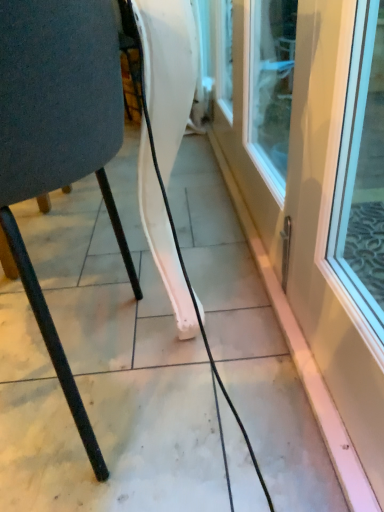
Question: Considering the positions of white glossy door at right and matte black chair at left in the image, is white glossy door at right bigger or smaller than matte black chair at left?

Choices:
 (A) small
 (B) big

Answer: (A)

Question: Considering the positions of white glossy door at right and matte black chair at left in the image, is white glossy door at right wider or thinner than matte black chair at left?

Choices:
 (A) wide
 (B) thin

Answer: (B)

Question: Does point (377, 147) appear closer or farther from the camera than point (114, 203)?

Choices:
 (A) closer
 (B) farther

Answer: (A)

Question: Would you say matte black chair at left is to the left or to the right of white glossy door at right in the picture?

Choices:
 (A) right
 (B) left

Answer: (B)

Question: In terms of height, does matte black chair at left look taller or shorter compared to white glossy door at right?

Choices:
 (A) tall
 (B) short

Answer: (A)

Question: Looking at their shapes, would you say matte black chair at left is wider or thinner than white glossy door at right?

Choices:
 (A) wide
 (B) thin

Answer: (A)

Question: Based on their sizes in the image, would you say matte black chair at left is bigger or smaller than white glossy door at right?

Choices:
 (A) small
 (B) big

Answer: (B)